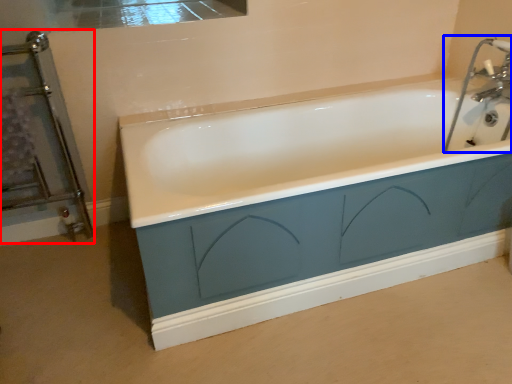
Question: Which point is closer to the camera, screen door (highlighted by a red box) or sink (highlighted by a blue box)?

Choices:
 (A) screen door
 (B) sink

Answer: (A)